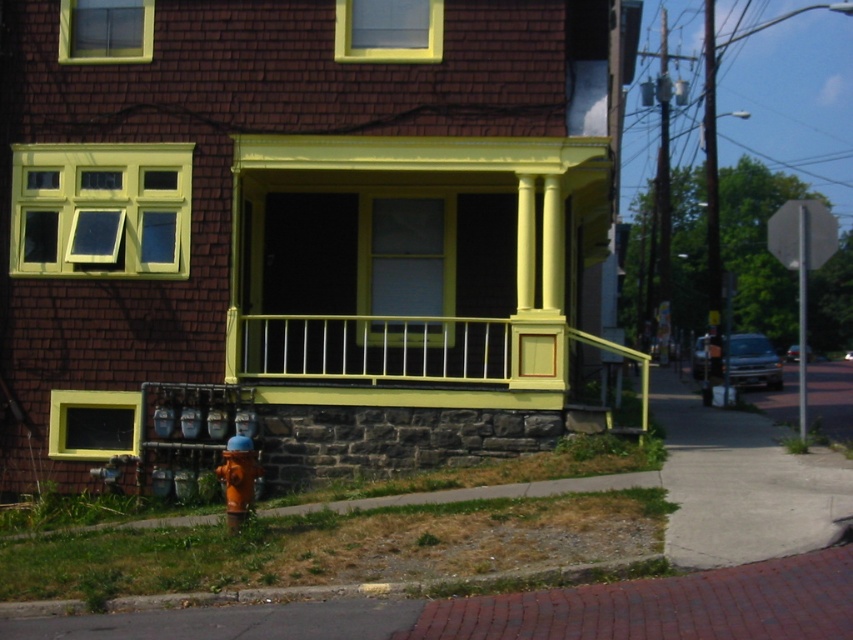
Question: Can you confirm if brick pavement at lower right is wider than orange matte hydrant at lower left?

Choices:
 (A) yes
 (B) no

Answer: (A)

Question: Which object is closer to the camera taking this photo?

Choices:
 (A) orange matte hydrant at lower left
 (B) brick pavement at lower right

Answer: (B)

Question: Is brick pavement at lower right smaller than orange matte hydrant at lower left?

Choices:
 (A) yes
 (B) no

Answer: (B)

Question: Is brick pavement at lower right wider than orange matte hydrant at lower left?

Choices:
 (A) no
 (B) yes

Answer: (B)